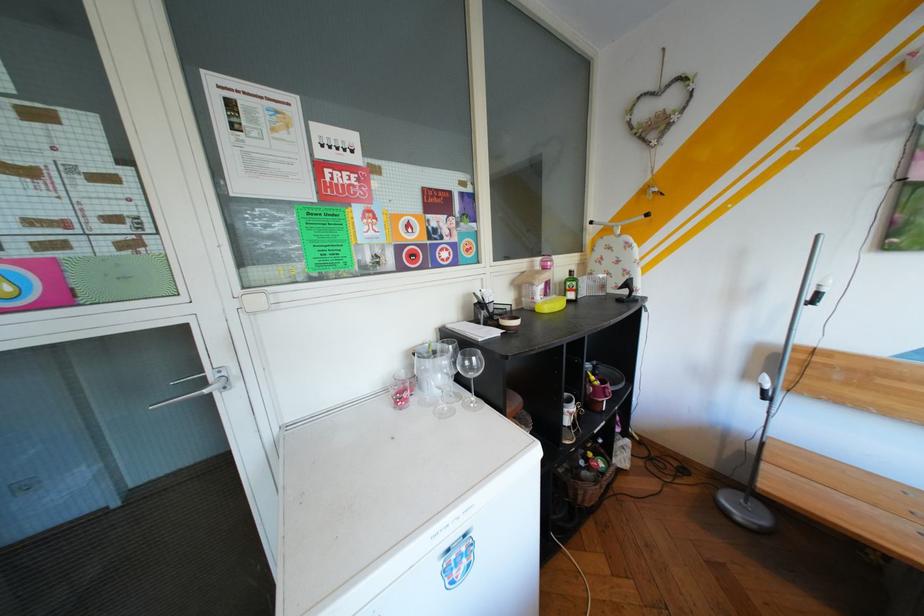
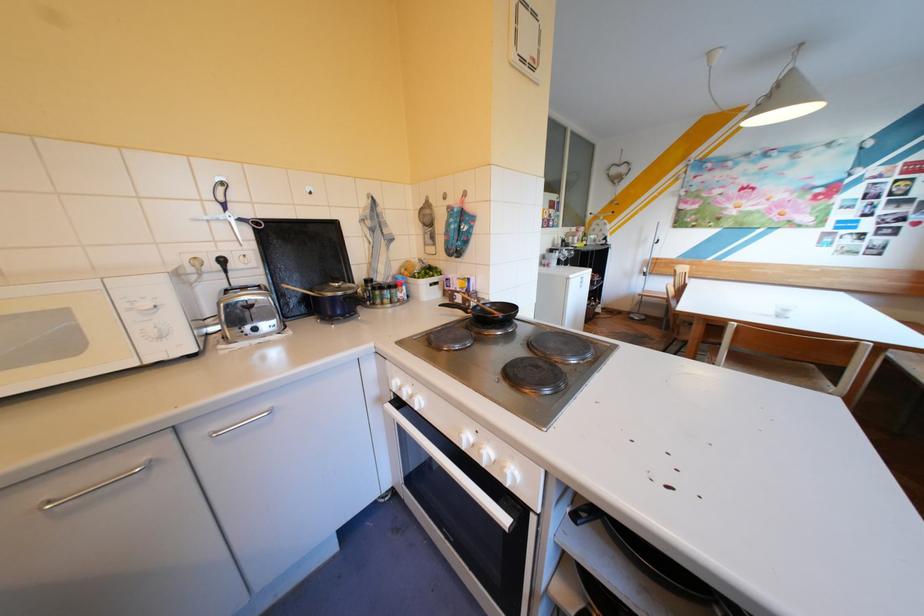
Which direction would the cameraman need to move to produce the second image?

The cameraman moved toward left, backward.